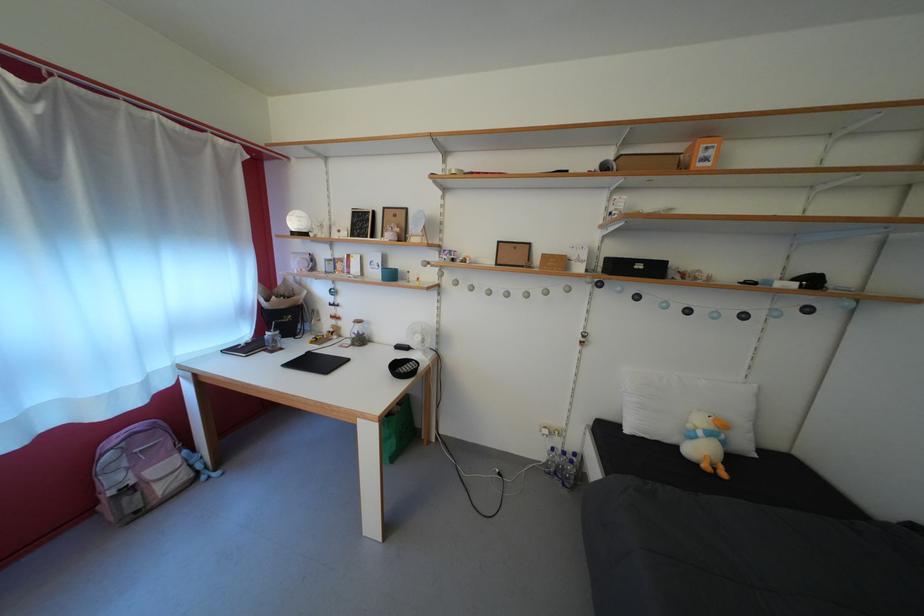
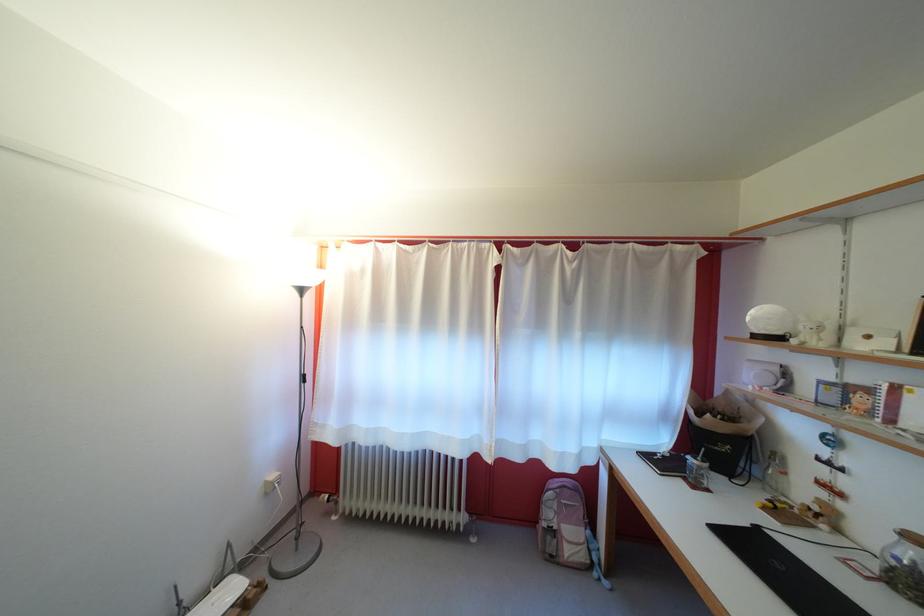
The point at (358,347) is marked in the first image. Where is the corresponding point in the second image?

(881, 570)